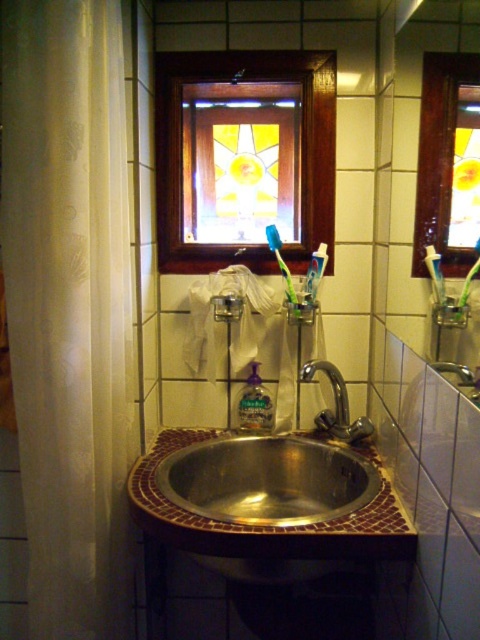
Question: Is chrome metallic faucet at center to the right of green plastic toothbrush at center from the viewer's perspective?

Choices:
 (A) yes
 (B) no

Answer: (B)

Question: Observing the image, what is the correct spatial positioning of stainless steel sink at center in reference to translucent plastic soap dispenser at center?

Choices:
 (A) above
 (B) below

Answer: (B)

Question: Which object is positioned farthest from the green plastic toothbrush at center?

Choices:
 (A) translucent plastic soap dispenser at center
 (B) chrome metallic faucet at center

Answer: (A)

Question: Which object is positioned closest to the silver metallic faucet at sink center?

Choices:
 (A) white matte toothpaste at center
 (B) white sheer curtain at left
 (C) blue plastic toothbrush at upper center

Answer: (A)

Question: Among these objects, which one is nearest to the camera?

Choices:
 (A) white sheer curtain at left
 (B) chrome metallic faucet at center
 (C) stained glass wood at upper center

Answer: (A)

Question: Is stained glass wood at upper center above green plastic toothbrush at right?

Choices:
 (A) no
 (B) yes

Answer: (B)